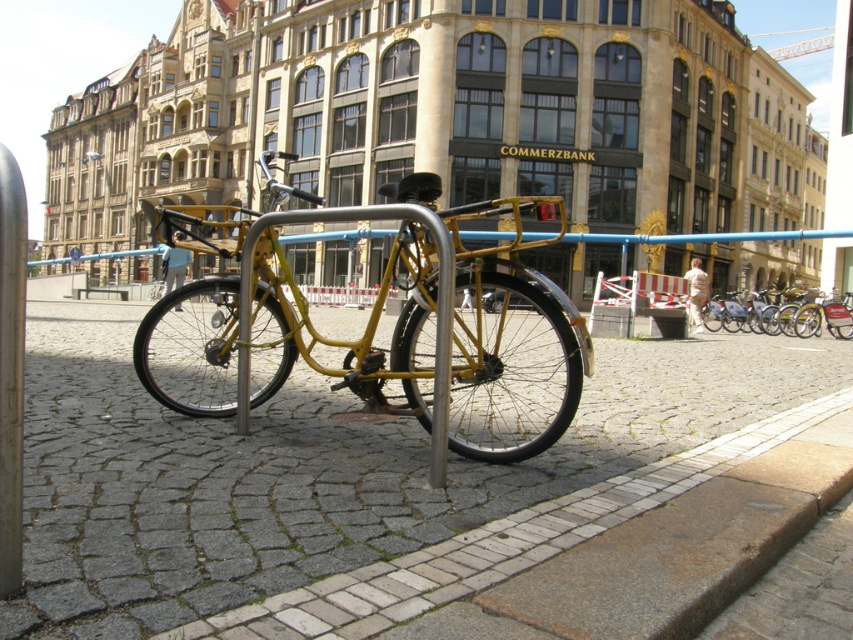
Between point (395, 209) and point (781, 296), which one is positioned behind?

The point (781, 296) is more distant.

Which is in front, point (471, 260) or point (730, 307)?

Positioned in front is point (471, 260).

Does point (271, 371) come in front of point (851, 310)?

Yes.

You are a GUI agent. You are given a task and a screenshot of the screen. Output one action in this format:
    pyautogui.click(x=<x>, y=<y>)
    Task: Click on the yellow matte bicycle at center
    Image resolution: width=853 pixels, height=640 pixels.
    Given the screenshot: What is the action you would take?
    pyautogui.click(x=281, y=326)

Is smooth cobblestone pavement at center to the left of yellow matte bicycle at center from the viewer's perspective?

In fact, smooth cobblestone pavement at center is to the right of yellow matte bicycle at center.

Looking at this image, is smooth cobblestone pavement at center below yellow matte bicycle at center?

Yes, smooth cobblestone pavement at center is below yellow matte bicycle at center.

Does point (268, 564) lie behind point (482, 288)?

No, (268, 564) is closer to viewer.

Where is `smooth cobblestone pavement at center`? smooth cobblestone pavement at center is located at coordinates (315, 467).

Can you confirm if smooth cobblestone pavement at center is positioned above matte yellow bicycle at center?

Incorrect, smooth cobblestone pavement at center is not positioned above matte yellow bicycle at center.

Who is lower down, smooth cobblestone pavement at center or matte yellow bicycle at center?

smooth cobblestone pavement at center is below.

Does point (398, 460) lie in front of point (813, 316)?

Yes, it is.

The height and width of the screenshot is (640, 853). In order to click on smooth cobblestone pavement at center in this screenshot , I will do `click(315, 467)`.